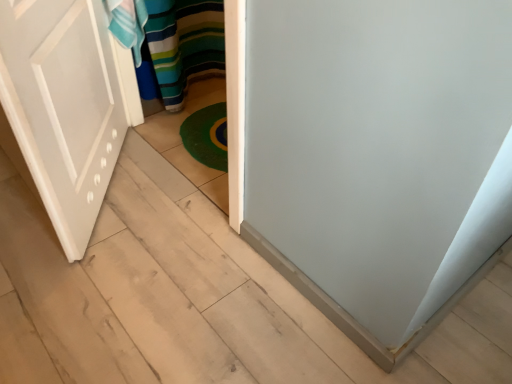
This screenshot has height=384, width=512. In order to click on white matte door at left in this screenshot , I will do `click(66, 105)`.

The width and height of the screenshot is (512, 384). What do you see at coordinates (66, 105) in the screenshot? I see `white matte door at left` at bounding box center [66, 105].

Identify the location of white matte door at left. (66, 105).